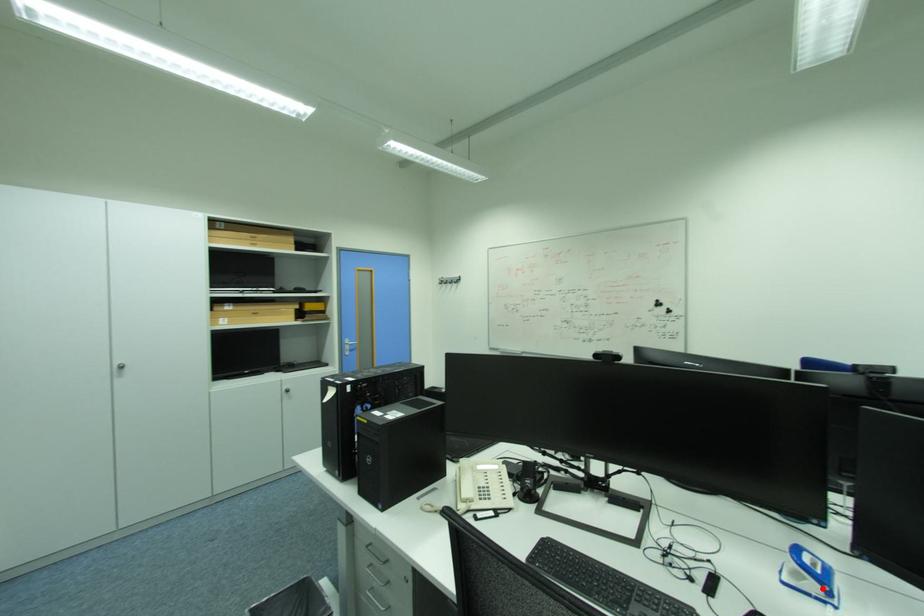
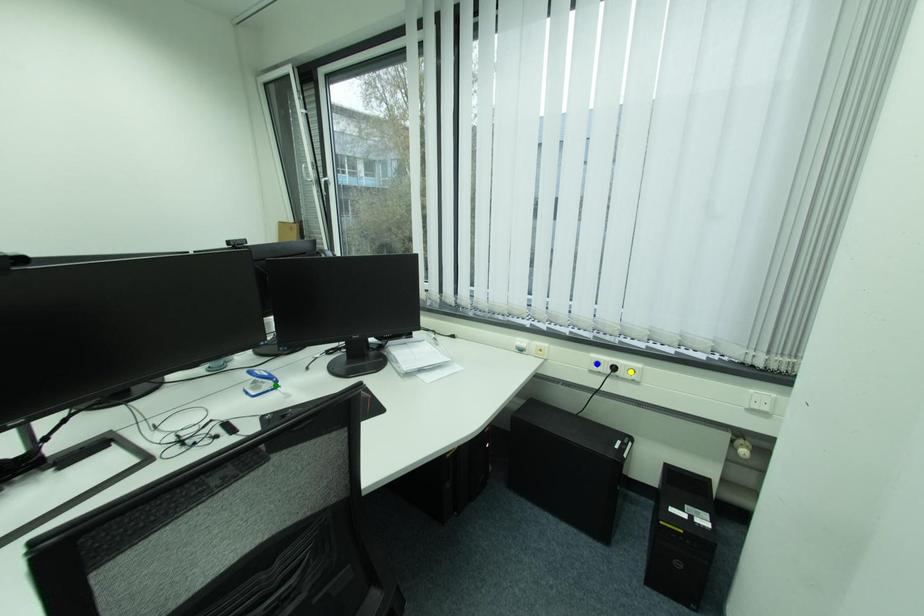
Question: I am providing you with two images of the same scene from different viewpoints. A red point is marked on the first image. You are given multiple points on the second image. Which point in image 2 represents the same 3d spot as the red point in image 1?

Choices:
 (A) blue point
 (B) yellow point
 (C) green point

Answer: (C)